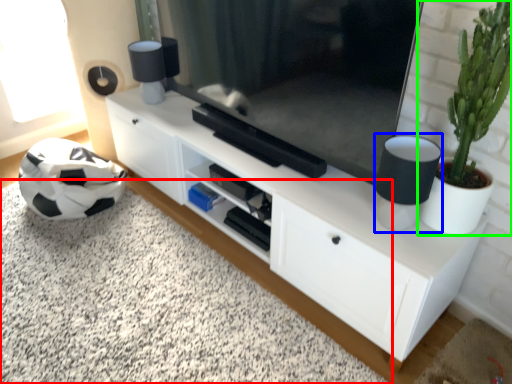
Question: Which is nearer to the plain (highlighted by a red box)? lamp (highlighted by a blue box) or houseplant (highlighted by a green box).

Choices:
 (A) lamp
 (B) houseplant

Answer: (A)